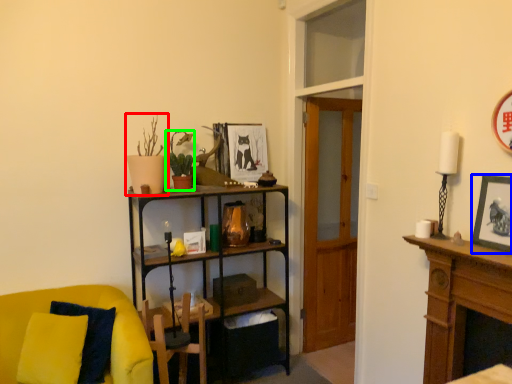
Question: Estimate the real-world distances between objects in this image. Which object is closer to houseplant (highlighted by a red box), picture frame (highlighted by a blue box) or houseplant (highlighted by a green box)?

Choices:
 (A) picture frame
 (B) houseplant

Answer: (B)